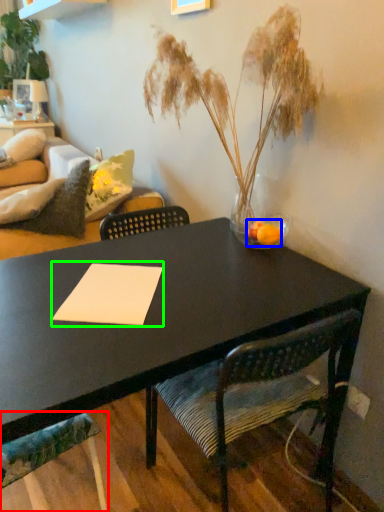
Question: Considering the real-world distances, which object is farthest from chair (highlighted by a red box)? flower (highlighted by a blue box) or notepad (highlighted by a green box)?

Choices:
 (A) flower
 (B) notepad

Answer: (A)